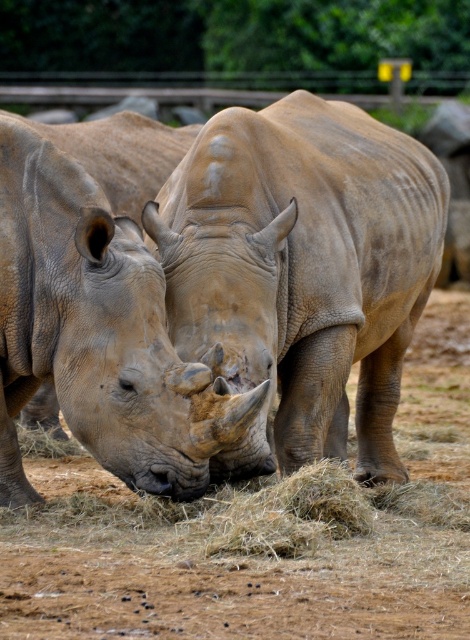
Question: Which object is farther from the camera taking this photo?

Choices:
 (A) brown dirt field at center
 (B) smooth beige rhino at left

Answer: (B)

Question: Does brown dirt field at center have a larger size compared to smooth beige rhino at center?

Choices:
 (A) yes
 (B) no

Answer: (B)

Question: Can you confirm if brown dirt field at center is wider than smooth beige rhino at left?

Choices:
 (A) yes
 (B) no

Answer: (A)

Question: Can you confirm if brown dirt field at center is smaller than smooth beige rhino at left?

Choices:
 (A) yes
 (B) no

Answer: (A)

Question: Which point is farther from the camera taking this photo?

Choices:
 (A) (45, 276)
 (B) (38, 529)
 (C) (311, 236)

Answer: (C)

Question: Estimate the real-world distances between objects in this image. Which object is farther from the smooth beige rhino at left?

Choices:
 (A) brown dirt field at center
 (B) smooth beige rhino at center

Answer: (A)